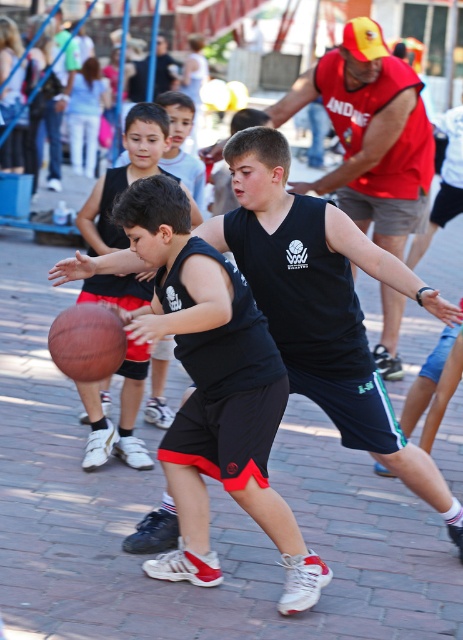
Question: Estimate the real-world distances between objects in this image. Which object is closer to the brown leather basketball at center?

Choices:
 (A) black matte shorts at center
 (B) matte black basketball at left

Answer: (A)

Question: Is black matte shorts at center bigger than matte black basketball at left?

Choices:
 (A) yes
 (B) no

Answer: (A)

Question: Considering the relative positions of black matte shorts at center and brown leather basketball at center in the image provided, where is black matte shorts at center located with respect to brown leather basketball at center?

Choices:
 (A) left
 (B) right

Answer: (B)

Question: Which point is farther to the camera?

Choices:
 (A) brown leather basketball at center
 (B) black matte shorts at center

Answer: (A)

Question: From the image, what is the correct spatial relationship of black matte shorts at center in relation to matte black basketball at left?

Choices:
 (A) right
 (B) left

Answer: (A)

Question: Which point is farther to the camera?

Choices:
 (A) red fabric shirt at center
 (B) brown leather basketball at center
 (C) black matte shorts at center

Answer: (A)